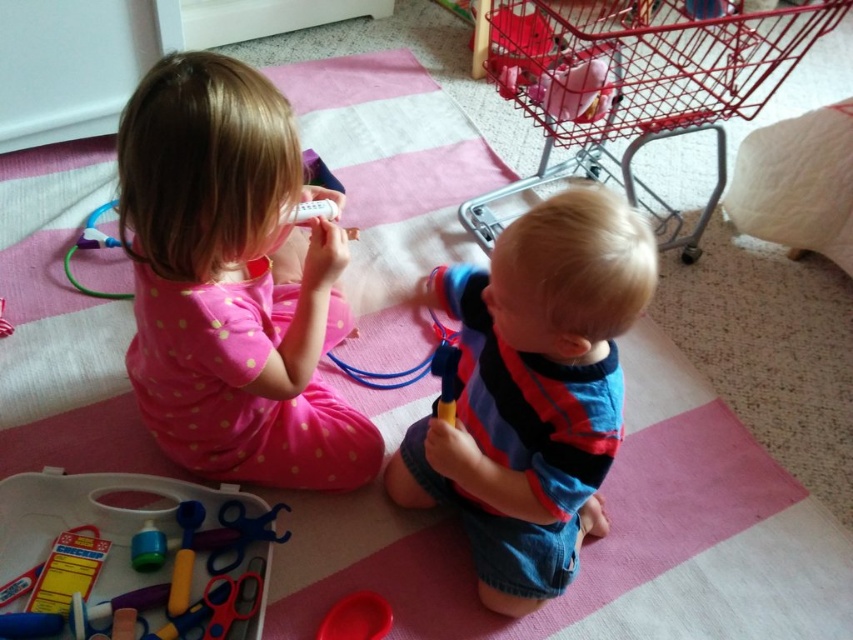
Does plastic scissors at lower left appear on the right side of rubberized plastic toy at lower center?

Incorrect, plastic scissors at lower left is not on the right side of rubberized plastic toy at lower center.

Is plastic scissors at lower left smaller than rubberized plastic toy at lower center?

No.

Is point (106, 563) closer to camera compared to point (450, 372)?

No, (106, 563) is behind (450, 372).

Where is `plastic scissors at lower left`? This screenshot has width=853, height=640. plastic scissors at lower left is located at coordinates coord(123,550).

Can you confirm if pink polka dot pajamas at upper left is taller than rubberized plastic toy at lower center?

Yes, pink polka dot pajamas at upper left is taller than rubberized plastic toy at lower center.

Does pink polka dot pajamas at upper left appear on the right side of rubberized plastic toy at lower center?

In fact, pink polka dot pajamas at upper left is to the left of rubberized plastic toy at lower center.

Where is `pink polka dot pajamas at upper left`? pink polka dot pajamas at upper left is located at coordinates (231, 284).

Find the location of a particular element. Image resolution: width=853 pixels, height=640 pixels. pink polka dot pajamas at upper left is located at coordinates (231, 284).

Does plastic scissors at lower left have a larger size compared to rubber red bowl at lower center?

Yes, plastic scissors at lower left is bigger than rubber red bowl at lower center.

Between plastic scissors at lower left and rubber red bowl at lower center, which one has less height?

rubber red bowl at lower center is shorter.

What do you see at coordinates (123, 550) in the screenshot?
I see `plastic scissors at lower left` at bounding box center [123, 550].

The height and width of the screenshot is (640, 853). I want to click on plastic scissors at lower left, so click(123, 550).